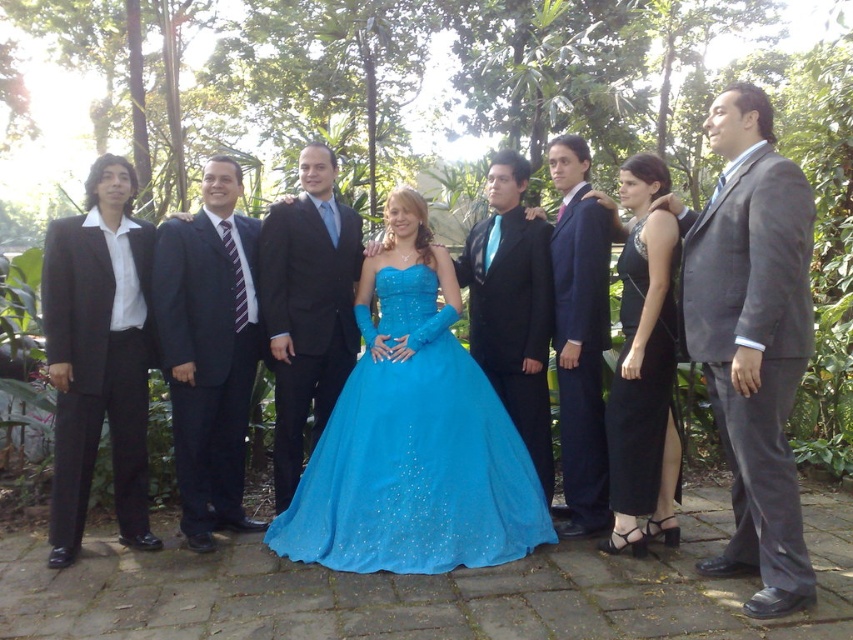
Question: Which point is closer to the camera?

Choices:
 (A) (164, 365)
 (B) (752, 563)
 (C) (566, 170)

Answer: (B)

Question: Is turquoise satin gown at center to the left of shiny black suit at center from the viewer's perspective?

Choices:
 (A) yes
 (B) no

Answer: (B)

Question: Considering the real-world distances, which object is farthest from the shiny black suit at center?

Choices:
 (A) turquoise satin gown at center
 (B) satin dark blue suit at center
 (C) gray suit at right

Answer: (C)

Question: Can you confirm if black satin dress at center is wider than shiny black suit at center?

Choices:
 (A) no
 (B) yes

Answer: (A)

Question: Can you confirm if gray suit at right is thinner than shiny black suit at center?

Choices:
 (A) yes
 (B) no

Answer: (A)

Question: Estimate the real-world distances between objects in this image. Which object is closer to the matte black suit at center?

Choices:
 (A) satin dark blue suit at center
 (B) gray suit at right
 (C) black satin dress at center
 (D) black smooth suit at left

Answer: (A)